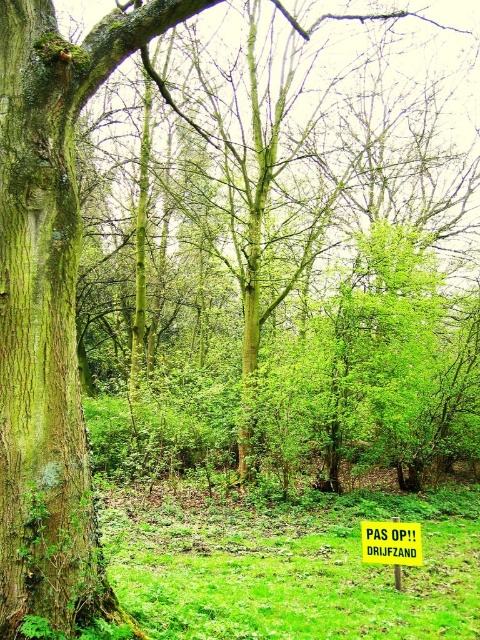
Is green grass at lower center thinner than yellow rectangular sign at center?

In fact, green grass at lower center might be wider than yellow rectangular sign at center.

Can you confirm if green grass at lower center is smaller than yellow rectangular sign at center?

No.

Is point (120, 554) in front of point (365, 552)?

That is False.

The image size is (480, 640). Find the location of `green grass at lower center`. green grass at lower center is located at coordinates [290, 564].